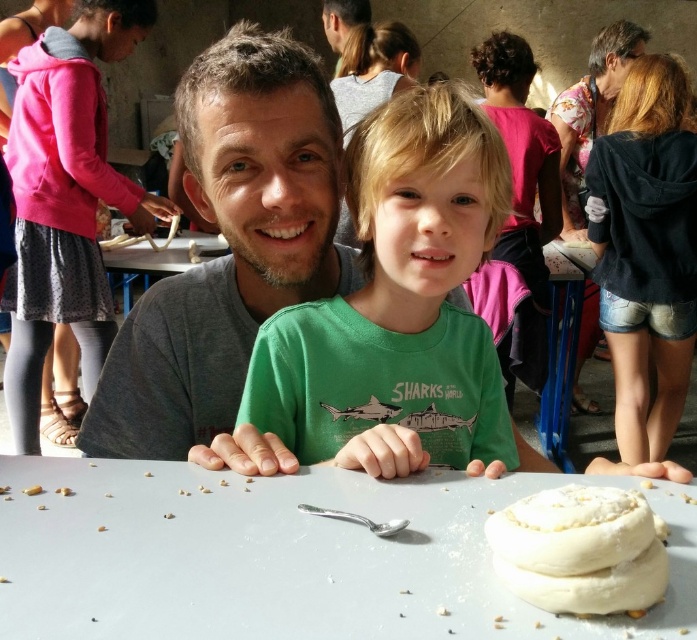
Question: Is white matte table at center thinner than white doughnut at center?

Choices:
 (A) no
 (B) yes

Answer: (A)

Question: Among these objects, which one is nearest to the camera?

Choices:
 (A) green matte shirt at center
 (B) white doughnut at center
 (C) white matte table at center

Answer: (C)

Question: Does pink fabric at left appear on the right side of pink fabric at upper center?

Choices:
 (A) yes
 (B) no

Answer: (B)

Question: Which of the following is the closest to the observer?

Choices:
 (A) (26, 161)
 (B) (536, 129)
 (C) (615, 608)

Answer: (C)

Question: Which point is farther from the camera taking this photo?

Choices:
 (A) (381, 445)
 (B) (493, 64)
 (C) (52, 317)
 (D) (43, 531)

Answer: (B)

Question: Is the position of white matte table at center more distant than that of pink fabric at left?

Choices:
 (A) no
 (B) yes

Answer: (A)